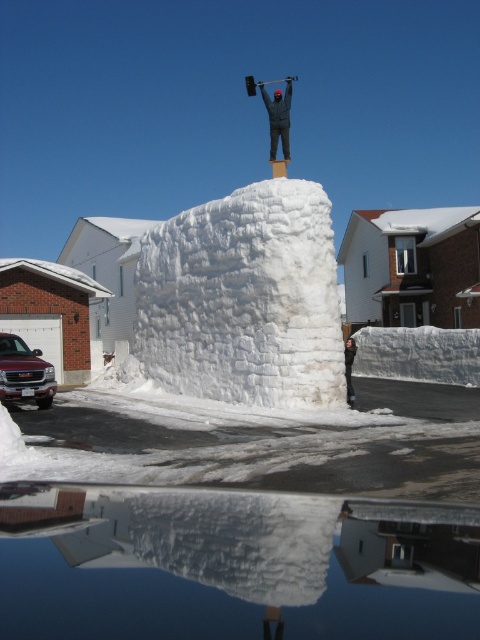
Does dark gray fabric at center appear under dark gray fabric jacket at center?

No, dark gray fabric at center is not below dark gray fabric jacket at center.

The width and height of the screenshot is (480, 640). Identify the location of dark gray fabric at center. (278, 116).